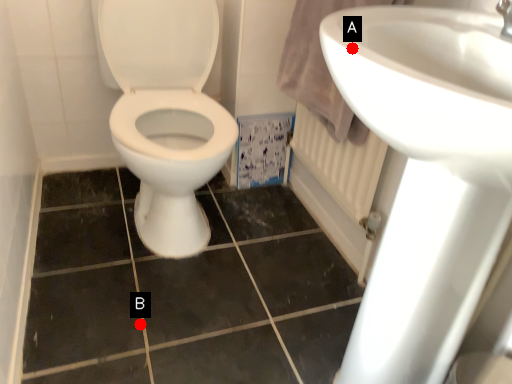
Question: Two points are circled on the image, labeled by A and B beside each circle. Which point appears farthest from the camera in this image?

Choices:
 (A) A is further
 (B) B is further

Answer: (B)